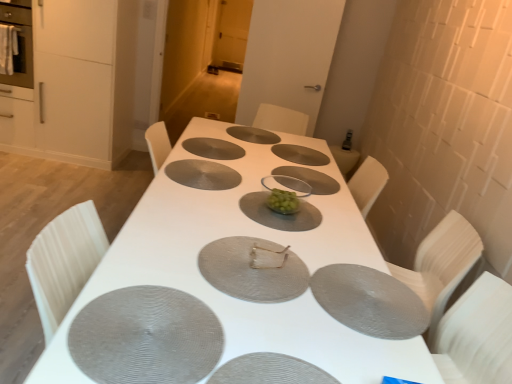
You are a GUI agent. You are given a task and a screenshot of the screen. Output one action in this format:
    pyautogui.click(x=<x>, y=<y>)
    Task: Click on the vacant space to the right of metallic silver napkin at center
    
    Given the screenshot: What is the action you would take?
    pyautogui.click(x=325, y=269)